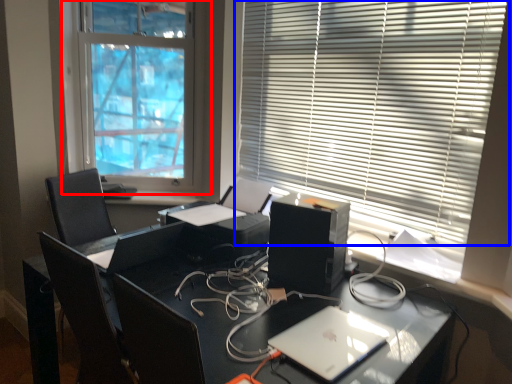
Question: Among these objects, which one is farthest to the camera, window blind (highlighted by a red box) or window blind (highlighted by a blue box)?

Choices:
 (A) window blind
 (B) window blind

Answer: (A)